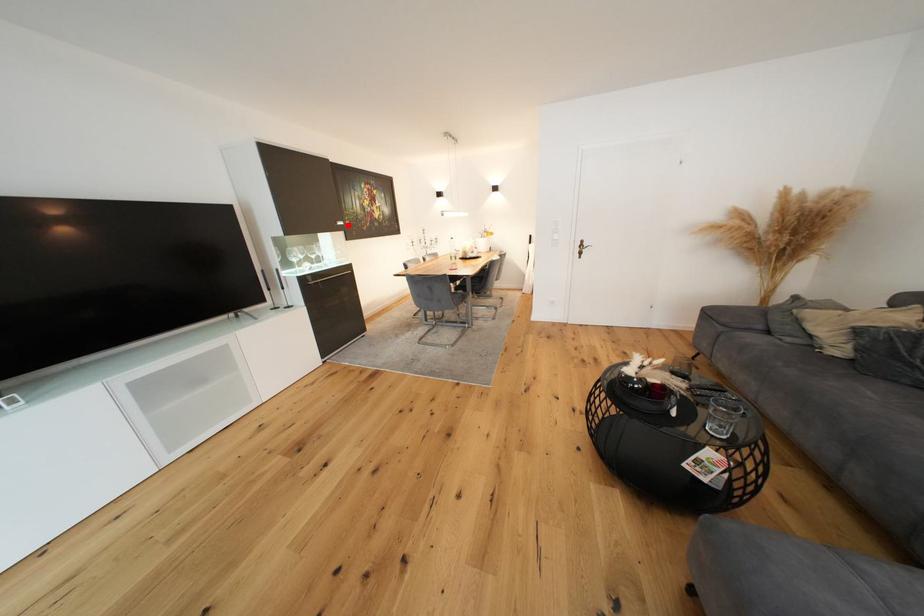
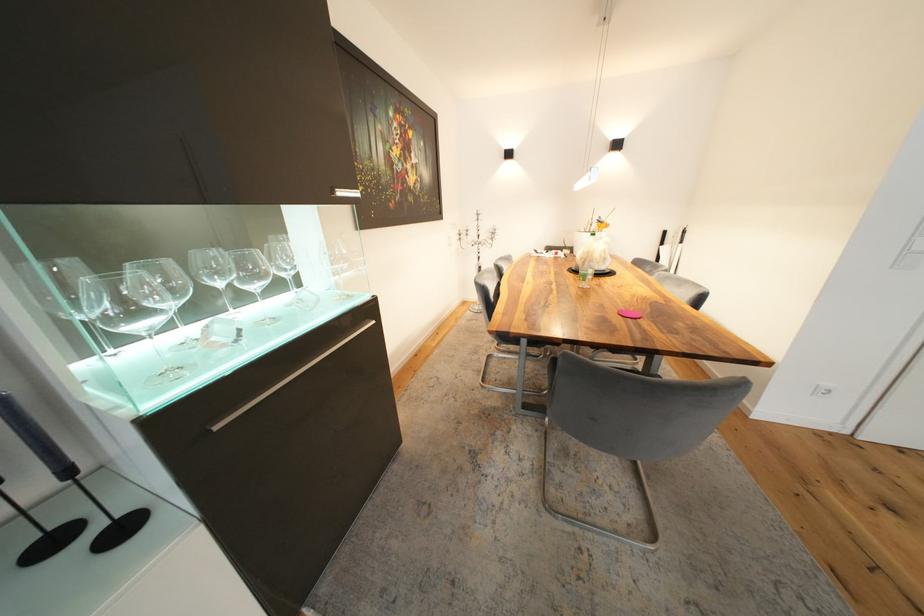
Where in the second image is the point corresponding to the highlighted location from the first image?

(348, 195)